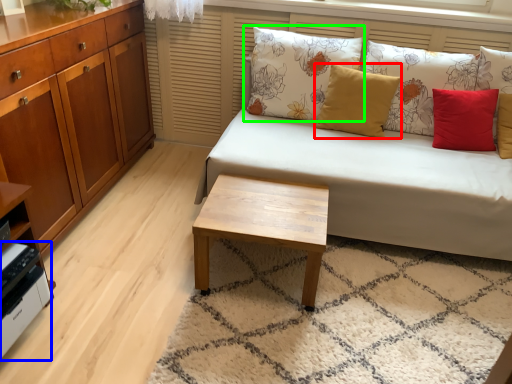
Question: Considering the real-world distances, which object is closest to pillow (highlighted by a red box)? appliance (highlighted by a blue box) or pillow (highlighted by a green box).

Choices:
 (A) appliance
 (B) pillow

Answer: (B)